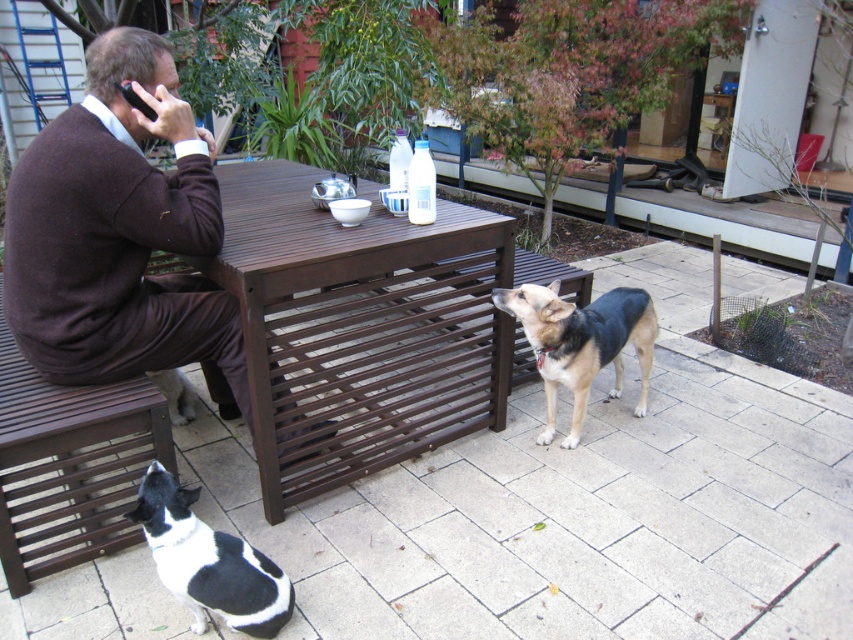
You are a photographer taking a picture of the brown wool sweater at left and the black and white fur dog at lower left. Which object should you focus on first if you want to capture both in the same frame without moving the camera?

The brown wool sweater at left is located above the black and white fur dog at lower left, so you should focus on the brown wool sweater at left first to ensure both are in the frame.

What are the coordinates of the brown wool sweater at left?

The brown wool sweater at left is located at coordinates point (120,236).

You are trying to place a large potted plant between the brown wooden table at center and the black fur dog at lower left. Considering their sizes, will the plant fit comfortably between them?

The brown wooden table at center is larger than the black fur dog at lower left, so there should be enough space to place the large potted plant between them comfortably.